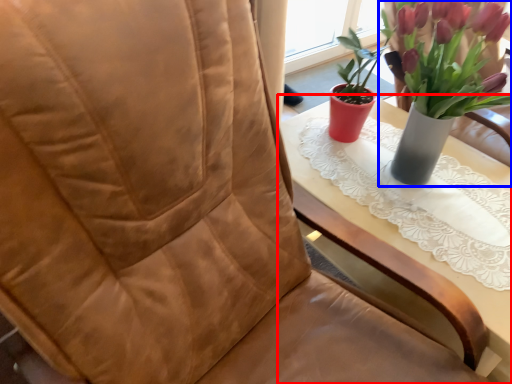
Question: Among these objects, which one is farthest to the camera, table (highlighted by a red box) or houseplant (highlighted by a blue box)?

Choices:
 (A) table
 (B) houseplant

Answer: (A)